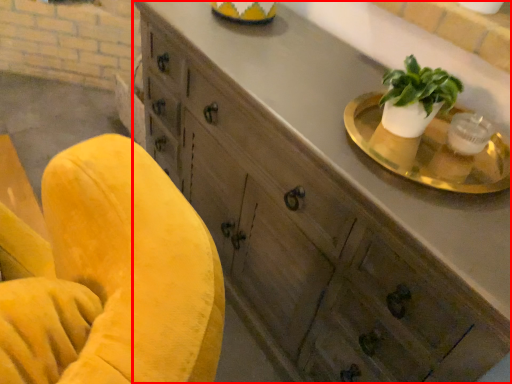
Question: From the image's perspective, considering the relative positions of cabinetry (annotated by the red box) and round table in the image provided, where is cabinetry (annotated by the red box) located with respect to the staircase?

Choices:
 (A) below
 (B) above

Answer: (A)